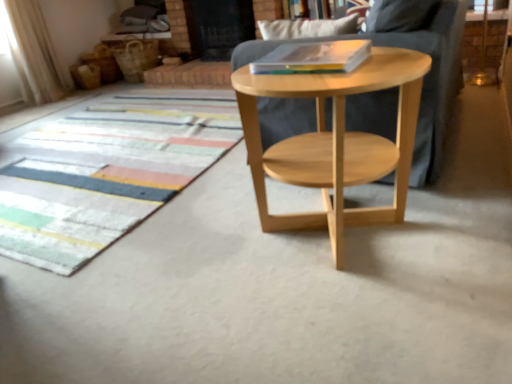
You are a GUI agent. You are given a task and a screenshot of the screen. Output one action in this format:
    pyautogui.click(x=<x>, y=<y>)
    Task: Click on the vacant space to the right of natural wood side table at center
    
    Given the screenshot: What is the action you would take?
    pyautogui.click(x=461, y=216)